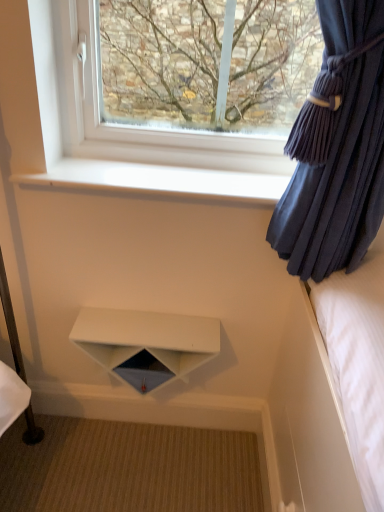
Question: From a real-world perspective, is white smooth window sill at upper center positioned under transparent glass window at upper center based on gravity?

Choices:
 (A) no
 (B) yes

Answer: (B)

Question: From the image's perspective, is white smooth window sill at upper center located beneath transparent glass window at upper center?

Choices:
 (A) no
 (B) yes

Answer: (B)

Question: Does white smooth window sill at upper center have a lesser width compared to transparent glass window at upper center?

Choices:
 (A) no
 (B) yes

Answer: (A)

Question: Are white smooth window sill at upper center and transparent glass window at upper center located far from each other?

Choices:
 (A) no
 (B) yes

Answer: (A)

Question: Does white smooth window sill at upper center appear on the left side of transparent glass window at upper center?

Choices:
 (A) yes
 (B) no

Answer: (B)

Question: Is white smooth window sill at upper center looking in the opposite direction of transparent glass window at upper center?

Choices:
 (A) yes
 (B) no

Answer: (B)

Question: Is transparent glass window at upper center in front of velvet dark blue curtain at right?

Choices:
 (A) no
 (B) yes

Answer: (A)

Question: Is transparent glass window at upper center further to camera compared to velvet dark blue curtain at right?

Choices:
 (A) no
 (B) yes

Answer: (B)

Question: Does transparent glass window at upper center have a greater height compared to velvet dark blue curtain at right?

Choices:
 (A) yes
 (B) no

Answer: (B)

Question: Is transparent glass window at upper center smaller than velvet dark blue curtain at right?

Choices:
 (A) no
 (B) yes

Answer: (B)

Question: Is transparent glass window at upper center located outside velvet dark blue curtain at right?

Choices:
 (A) no
 (B) yes

Answer: (B)

Question: From the image's perspective, is transparent glass window at upper center over velvet dark blue curtain at right?

Choices:
 (A) yes
 (B) no

Answer: (A)

Question: Is velvet dark blue curtain at right bigger than transparent glass window at upper center?

Choices:
 (A) no
 (B) yes

Answer: (B)